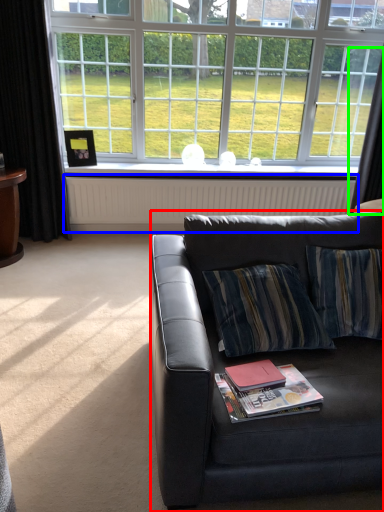
Question: Which object is the closest to the studio couch (highlighted by a red box)? Choose among these: radiator (highlighted by a blue box) or curtain (highlighted by a green box).

Choices:
 (A) radiator
 (B) curtain

Answer: (A)